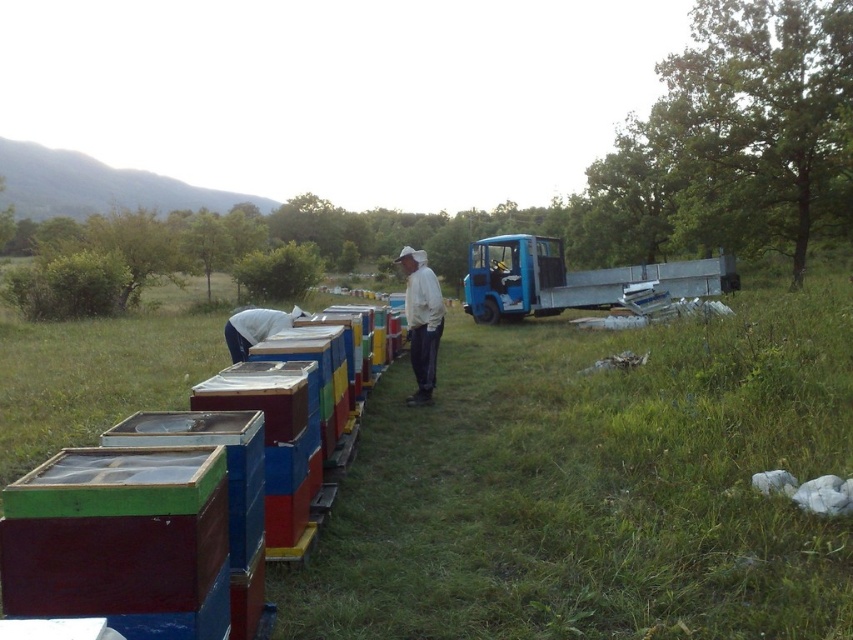
What do you see at coordinates (94, 376) in the screenshot? This screenshot has height=640, width=853. I see `multicolored painted beehive at center` at bounding box center [94, 376].

Between point (83, 408) and point (268, 317), which one is positioned behind?

The point (83, 408) is more distant.

Is point (16, 428) behind point (231, 332)?

No, it is in front of (231, 332).

Identify the location of multicolored painted beehive at center. (94, 376).

Who is more distant from viewer, (415, 278) or (244, 321)?

The point (415, 278) is behind.

Can you confirm if white matte jacket at center is positioned to the left of white fabric at center?

Incorrect, white matte jacket at center is not on the left side of white fabric at center.

This screenshot has width=853, height=640. Describe the element at coordinates (421, 321) in the screenshot. I see `white matte jacket at center` at that location.

You are a GUI agent. You are given a task and a screenshot of the screen. Output one action in this format:
    pyautogui.click(x=<x>, y=<y>)
    Task: Click on the white matte jacket at center
    This screenshot has width=853, height=640.
    Given the screenshot: What is the action you would take?
    pyautogui.click(x=421, y=321)

Which is behind, point (190, 330) or point (424, 260)?

Positioned behind is point (190, 330).

Does multicolored painted beehive at center appear under white matte jacket at center?

Indeed, multicolored painted beehive at center is positioned under white matte jacket at center.

Which is behind, point (119, 348) or point (397, 257)?

The point (397, 257) is behind.

Locate an element on the screen. The width and height of the screenshot is (853, 640). multicolored painted beehive at center is located at coordinates (94, 376).